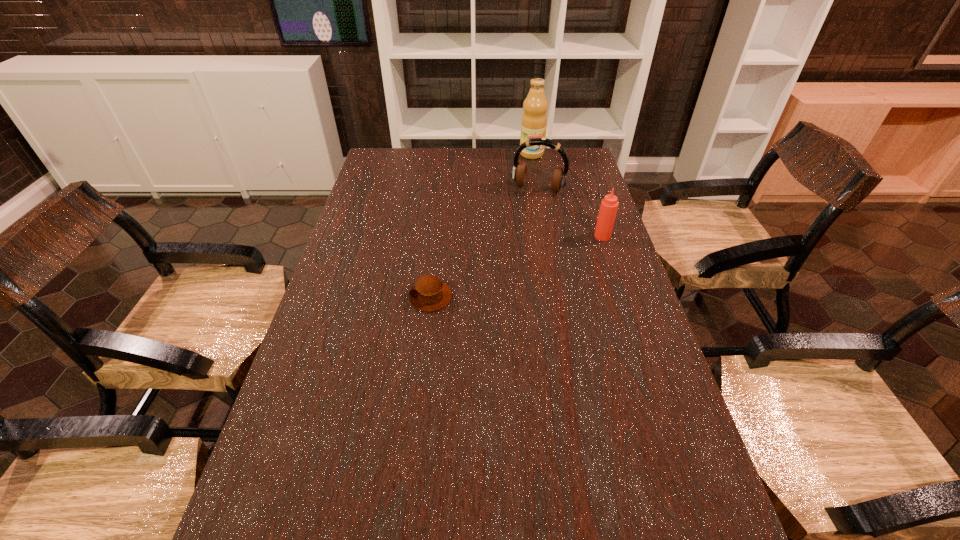
The image size is (960, 540). What are the coordinates of `free spot on the desktop that is between the nearest object and the second nearest object and is positioned on the ear cup of the headset` in the screenshot? It's located at (505, 271).

This screenshot has height=540, width=960. In order to click on vacant space on the desktop that is between the leftmost object and the third farthest object and is positioned on the label of the olive oil in this screenshot , I will do `click(543, 257)`.